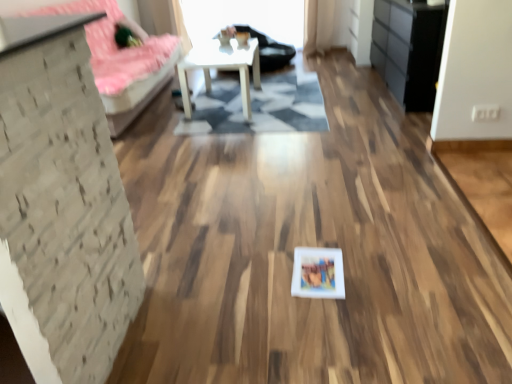
I want to click on vacant area that lies in front of white matte table at center, so click(x=240, y=123).